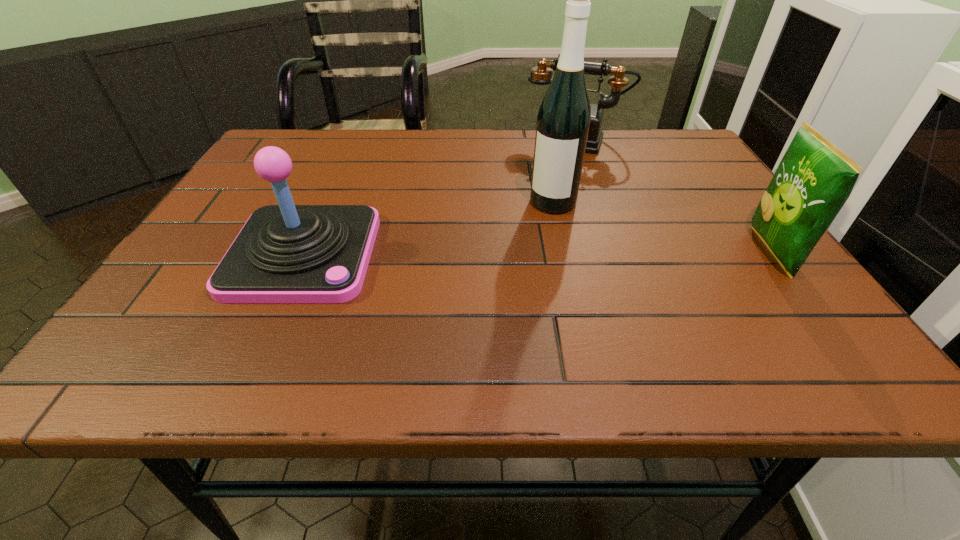
Find the location of a particular element. free space on the desktop that is between the leftmost object and the rightmost object and is positioned on the label of the tallest object is located at coordinates [x=522, y=253].

Find the location of a particular element. The height and width of the screenshot is (540, 960). free spot on the desktop that is between the joystick and the rightmost object and is positioned on the front of the telephone at the rotary dial is located at coordinates (534, 253).